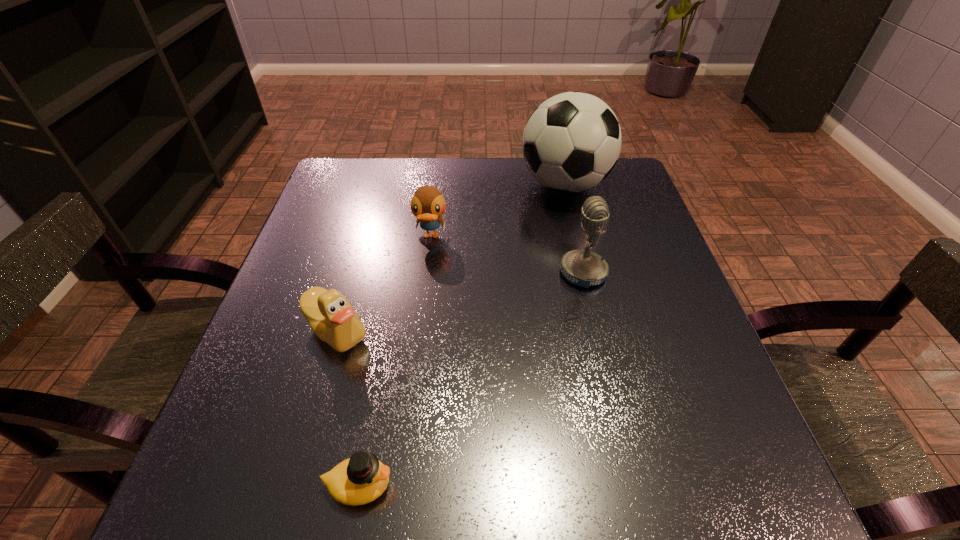
Image resolution: width=960 pixels, height=540 pixels. Find the location of `the farthest object`. the farthest object is located at coordinates (572, 141).

Locate an element on the screen. This screenshot has width=960, height=540. soccer ball is located at coordinates (572, 141).

Locate an element on the screen. the second tallest object is located at coordinates (584, 268).

The height and width of the screenshot is (540, 960). In order to click on microphone in this screenshot , I will do `click(584, 268)`.

The width and height of the screenshot is (960, 540). What are the coordinates of `the farthest duck` in the screenshot? It's located at (428, 204).

The height and width of the screenshot is (540, 960). I want to click on the second nearest object, so click(x=331, y=317).

The width and height of the screenshot is (960, 540). Find the location of `the shortest object`. the shortest object is located at coordinates (361, 479).

This screenshot has width=960, height=540. In order to click on the shortest duck in this screenshot , I will do `click(361, 479)`.

Locate an element on the screen. vacant space situated 0.270m on the front of the tallest object is located at coordinates (590, 292).

The image size is (960, 540). I want to click on vacant region located on the front-facing side of the second tallest object, so click(x=392, y=273).